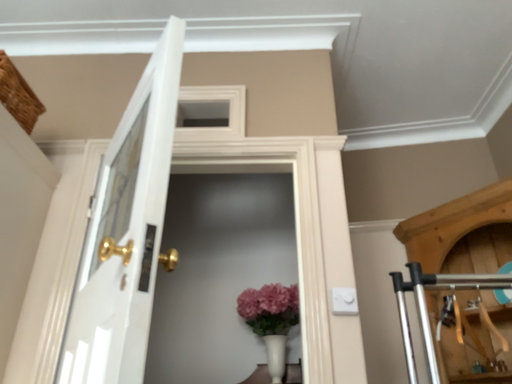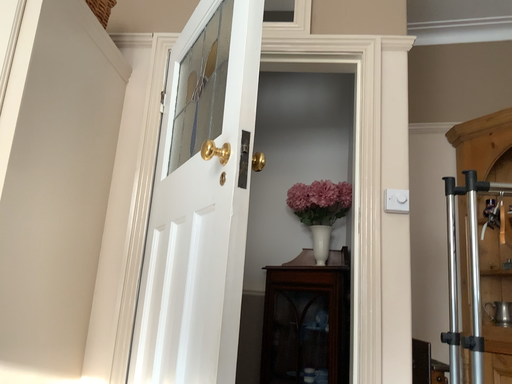
Question: Which way did the camera rotate in the video?

Choices:
 (A) rotated downward
 (B) rotated upward

Answer: (A)